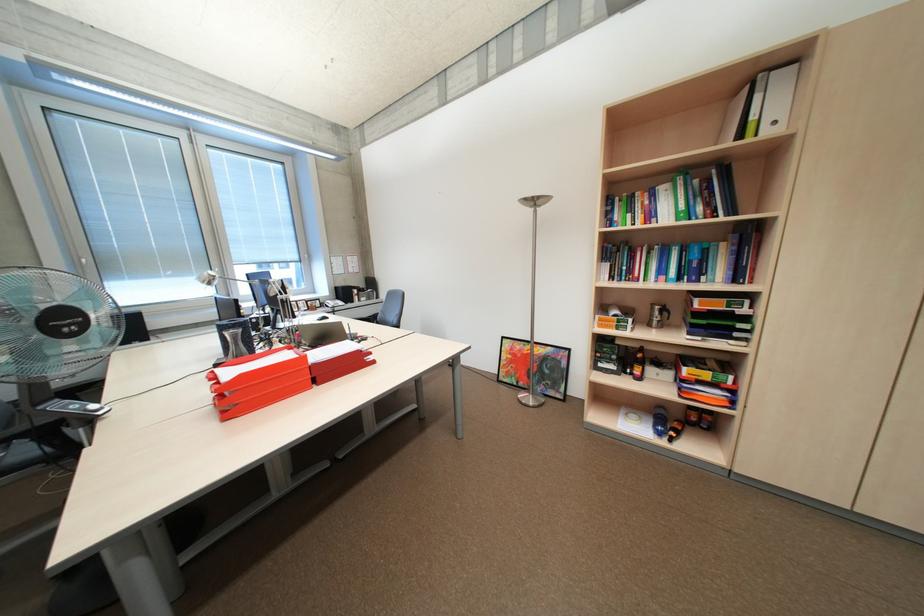
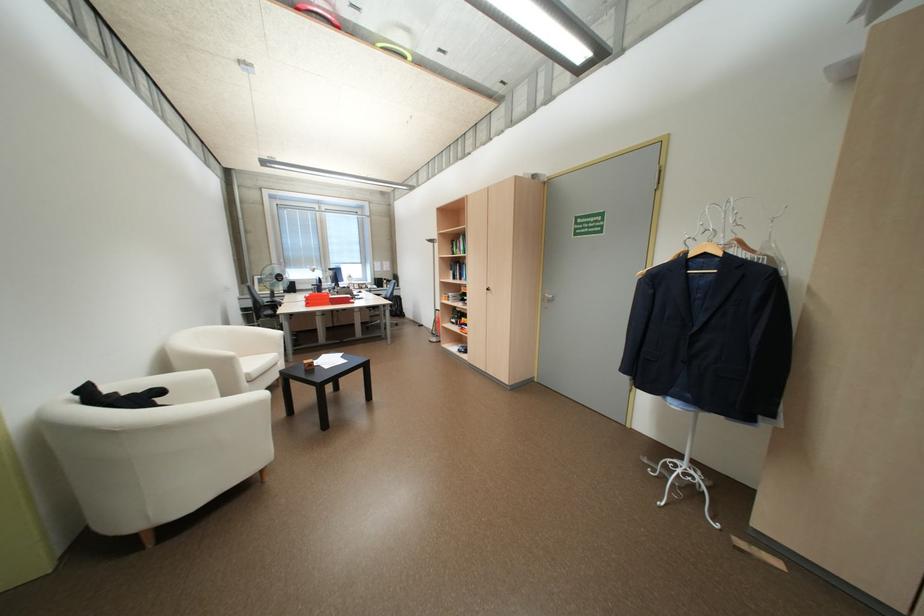
In the second image, find the point that corresponds to point (614, 282) in the first image.

(460, 280)